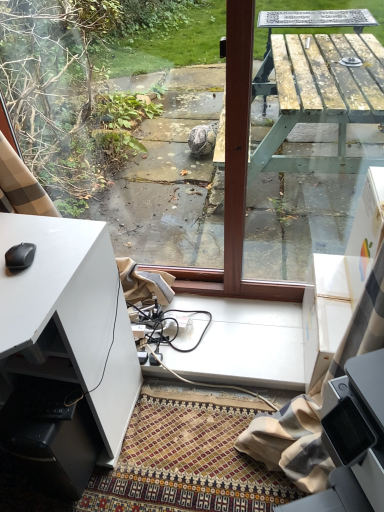
Question: Can you confirm if white matte desk at lower left is bigger than black matte mouse at lower left?

Choices:
 (A) no
 (B) yes

Answer: (B)

Question: Does white matte desk at lower left appear on the left side of black matte mouse at lower left?

Choices:
 (A) yes
 (B) no

Answer: (A)

Question: Is the position of white matte desk at lower left more distant than that of black matte mouse at lower left?

Choices:
 (A) yes
 (B) no

Answer: (B)

Question: Would you say black matte mouse at lower left is part of white matte desk at lower left's contents?

Choices:
 (A) no
 (B) yes

Answer: (A)

Question: From a real-world perspective, is white matte desk at lower left positioned over black matte mouse at lower left based on gravity?

Choices:
 (A) no
 (B) yes

Answer: (A)

Question: Can you confirm if white matte desk at lower left is wider than black matte mouse at lower left?

Choices:
 (A) no
 (B) yes

Answer: (B)

Question: Can you confirm if white matte desk at lower left is positioned to the right of wooden picnic table at center?

Choices:
 (A) yes
 (B) no

Answer: (B)

Question: Considering the relative sizes of white matte desk at lower left and wooden picnic table at center in the image provided, is white matte desk at lower left shorter than wooden picnic table at center?

Choices:
 (A) yes
 (B) no

Answer: (A)

Question: Can wooden picnic table at center be found inside white matte desk at lower left?

Choices:
 (A) yes
 (B) no

Answer: (B)

Question: Is the position of white matte desk at lower left more distant than that of wooden picnic table at center?

Choices:
 (A) no
 (B) yes

Answer: (A)

Question: From the image's perspective, would you say white matte desk at lower left is positioned over wooden picnic table at center?

Choices:
 (A) yes
 (B) no

Answer: (B)

Question: Could you tell me if white matte desk at lower left is facing wooden picnic table at center?

Choices:
 (A) yes
 (B) no

Answer: (B)

Question: Is wooden picnic table at center smaller than black matte mouse at lower left?

Choices:
 (A) no
 (B) yes

Answer: (A)